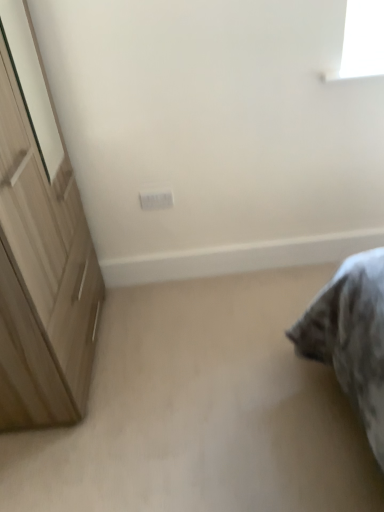
Question: Considering the positions of point (276, 460) and point (160, 195), is point (276, 460) closer or farther from the camera than point (160, 195)?

Choices:
 (A) farther
 (B) closer

Answer: (B)

Question: In terms of height, does beige carpet at lower right look taller or shorter compared to white plastic electric outlet at center?

Choices:
 (A) tall
 (B) short

Answer: (B)

Question: Based on their relative distances, which object is farther from the beige carpet at lower right?

Choices:
 (A) white plastic electric outlet at center
 (B) light brown wooden cupboard at left

Answer: (A)

Question: Which of these objects is positioned closest to the white plastic electric outlet at center?

Choices:
 (A) beige carpet at lower right
 (B) light brown wooden cupboard at left

Answer: (B)